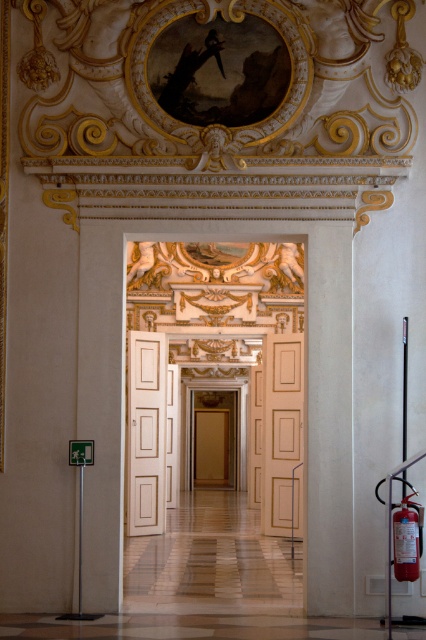
Does white glossy door at center lie behind red matte fire extinguisher at lower right?

Yes, white glossy door at center is further from the viewer.

Between white glossy door at center and red matte fire extinguisher at lower right, which one has more height?

white glossy door at center

This screenshot has width=426, height=640. Describe the element at coordinates (226, 362) in the screenshot. I see `white glossy door at center` at that location.

Image resolution: width=426 pixels, height=640 pixels. Find the location of `white glossy door at center`. white glossy door at center is located at coordinates (226, 362).